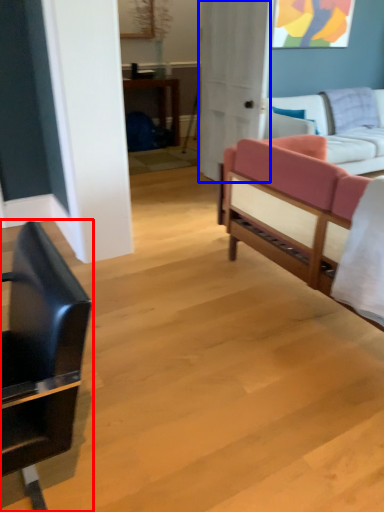
Question: Which of the following is the farthest to the observer, chair (highlighted by a red box) or glass door (highlighted by a blue box)?

Choices:
 (A) chair
 (B) glass door

Answer: (B)